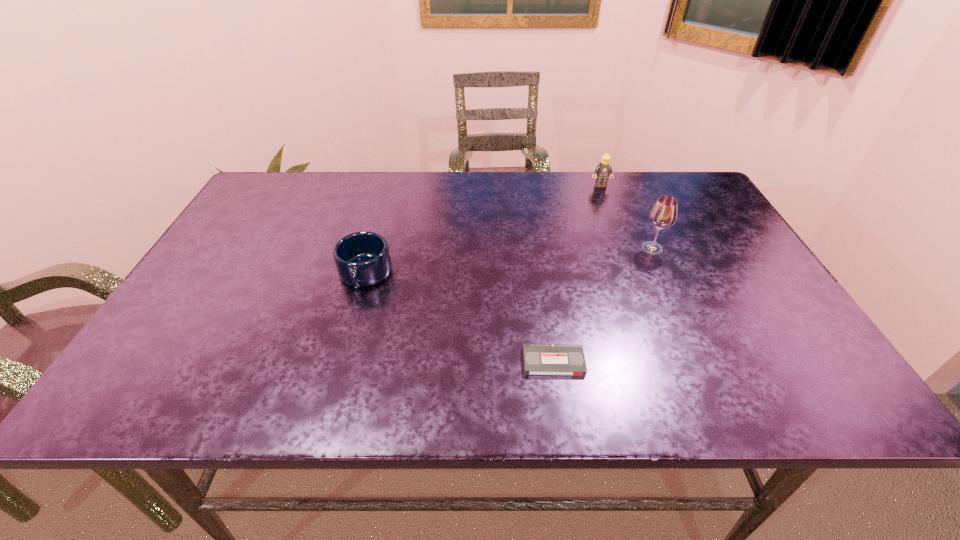
Locate which object ranks third in proximity to the second shortest object. Please provide its 2D coordinates. Your answer should be formatted as a tuple, i.e. [(x, y)], where the tuple contains the x and y coordinates of a point satisfying the conditions above.

[(603, 170)]

Find the location of a particular element. object that is the second closest to the mug is located at coordinates [663, 214].

Image resolution: width=960 pixels, height=540 pixels. In order to click on blank space that satisfies the following two spatial constraints: 1. on the back side of the videotape; 2. on the right side of the rightmost object in this screenshot , I will do `click(537, 248)`.